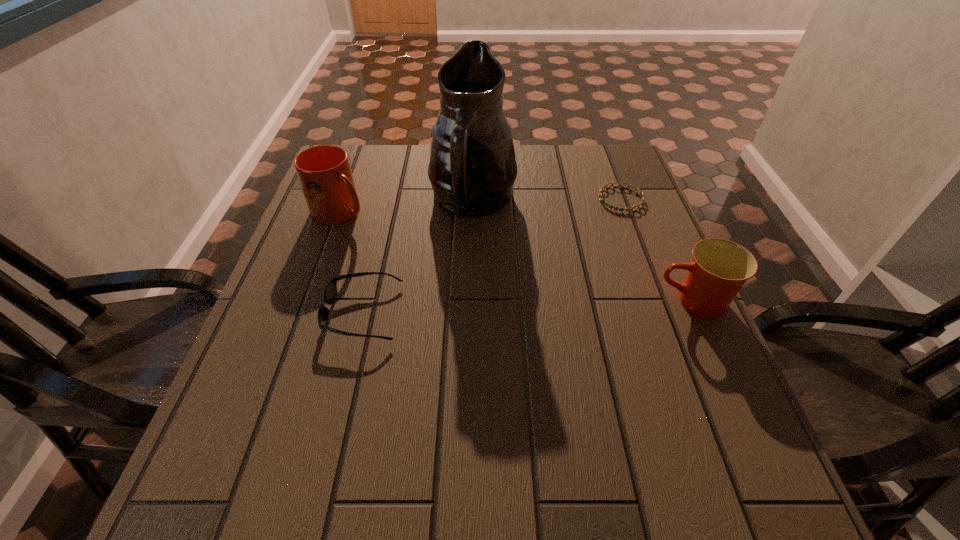
Identify the location of cup that is at the right edge. This screenshot has width=960, height=540. (719, 268).

Find the location of `bracelet positioned at the right edge`. bracelet positioned at the right edge is located at coordinates (603, 201).

Find the location of a particular element. The width and height of the screenshot is (960, 540). object that is positioned at the far right corner is located at coordinates (603, 201).

Where is `vacant space at the far edge of the desktop`? The height and width of the screenshot is (540, 960). vacant space at the far edge of the desktop is located at coordinates (531, 184).

Image resolution: width=960 pixels, height=540 pixels. Find the location of `blank area at the near edge`. blank area at the near edge is located at coordinates (540, 426).

Find the location of a particular element. This screenshot has width=960, height=540. free region at the left edge of the desktop is located at coordinates (300, 388).

You are a GUI agent. You are given a task and a screenshot of the screen. Output one action in this format:
    pyautogui.click(x=<x>, y=<y>)
    Task: Click on the vacant space at the right edge of the desktop
    The height and width of the screenshot is (540, 960).
    Given the screenshot: What is the action you would take?
    pyautogui.click(x=599, y=240)

In the image, there is a desktop. Where is `blank space at the far left corner`? The width and height of the screenshot is (960, 540). blank space at the far left corner is located at coordinates (375, 146).

Identify the location of free space at the near left corner of the desktop. Image resolution: width=960 pixels, height=540 pixels. (228, 403).

This screenshot has width=960, height=540. In the image, there is a desktop. Identify the location of blank space at the far right corner. (619, 157).